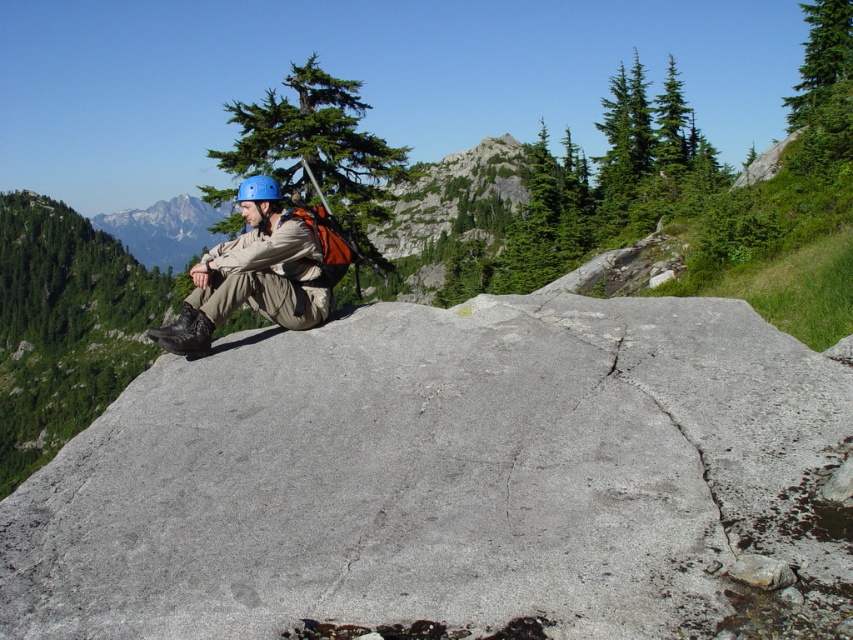
Can you confirm if matte blue helmet at center is thinner than matte gray rock at center?

Indeed, matte blue helmet at center has a lesser width compared to matte gray rock at center.

The image size is (853, 640). Describe the element at coordinates (260, 269) in the screenshot. I see `matte blue helmet at center` at that location.

You are a GUI agent. You are given a task and a screenshot of the screen. Output one action in this format:
    pyautogui.click(x=<x>, y=<y>)
    Task: Click on the matte blue helmet at center
    This screenshot has height=640, width=853.
    Given the screenshot: What is the action you would take?
    pyautogui.click(x=260, y=269)

Is point (447, 349) positioned before point (170, 200)?

Yes, it is in front of point (170, 200).

In the scene shown: Does gray rough rock at center appear on the left side of matte gray rock at center?

In fact, gray rough rock at center is to the right of matte gray rock at center.

You are a GUI agent. You are given a task and a screenshot of the screen. Output one action in this format:
    pyautogui.click(x=<x>, y=<y>)
    Task: Click on the gray rough rock at center
    
    Given the screenshot: What is the action you would take?
    point(448,477)

Locate an element on the screen. This screenshot has width=853, height=640. gray rough rock at center is located at coordinates tap(448, 477).

Between gray rough rock at center and matte blue helmet at center, which one has more height?

Standing taller between the two is matte blue helmet at center.

You are a GUI agent. You are given a task and a screenshot of the screen. Output one action in this format:
    pyautogui.click(x=<x>, y=<y>)
    Task: Click on the gray rough rock at center
    Image resolution: width=853 pixels, height=640 pixels.
    Given the screenshot: What is the action you would take?
    pyautogui.click(x=448, y=477)